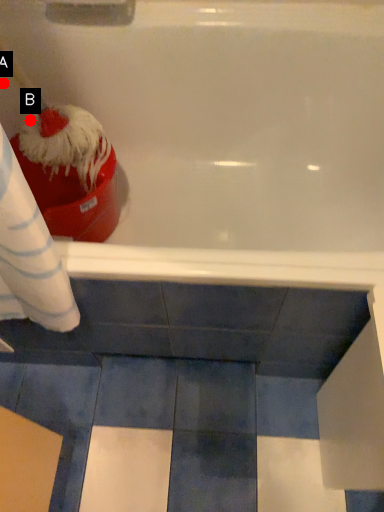
Question: Two points are circled on the image, labeled by A and B beside each circle. Which point is closer to the camera?

Choices:
 (A) A is closer
 (B) B is closer

Answer: (A)